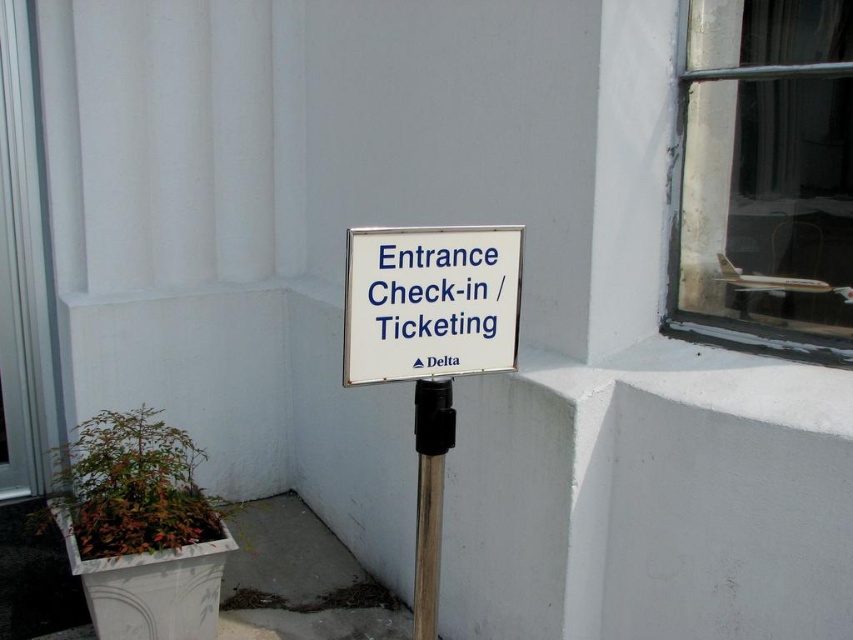
Question: Is white plastic sign at center thinner than metallic pole at center?

Choices:
 (A) yes
 (B) no

Answer: (B)

Question: Among these points, which one is nearest to the camera?

Choices:
 (A) (439, 256)
 (B) (425, 520)

Answer: (A)

Question: Is white plastic sign at center smaller than metallic pole at center?

Choices:
 (A) yes
 (B) no

Answer: (B)

Question: Does white plastic sign at center lie behind metallic pole at center?

Choices:
 (A) no
 (B) yes

Answer: (A)

Question: Which of the following is the closest to the observer?

Choices:
 (A) (450, 392)
 (B) (387, 323)

Answer: (B)